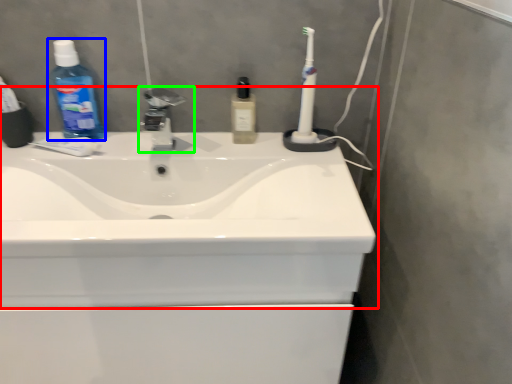
Question: Based on their relative distances, which object is nearer to sink (highlighted by a red box)? Choose from cleaning product (highlighted by a blue box) and tap (highlighted by a green box).

Choices:
 (A) cleaning product
 (B) tap

Answer: (B)